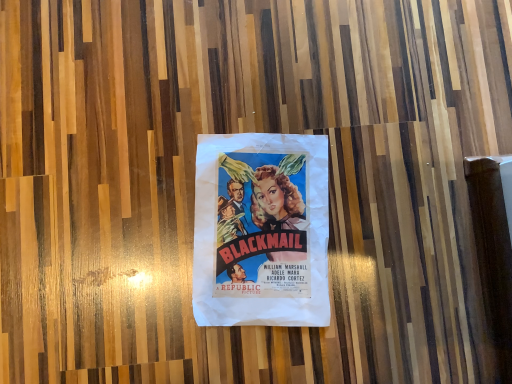
At what (x,y) coordinates should I click in order to perform the action: click on matte paper poster at center. Please return your answer as a coordinate pair (x, y). Looking at the image, I should click on (261, 230).

Describe the element at coordinates (261, 230) in the screenshot. I see `matte paper poster at center` at that location.

Where is `matte paper poster at center`? The width and height of the screenshot is (512, 384). matte paper poster at center is located at coordinates (261, 230).